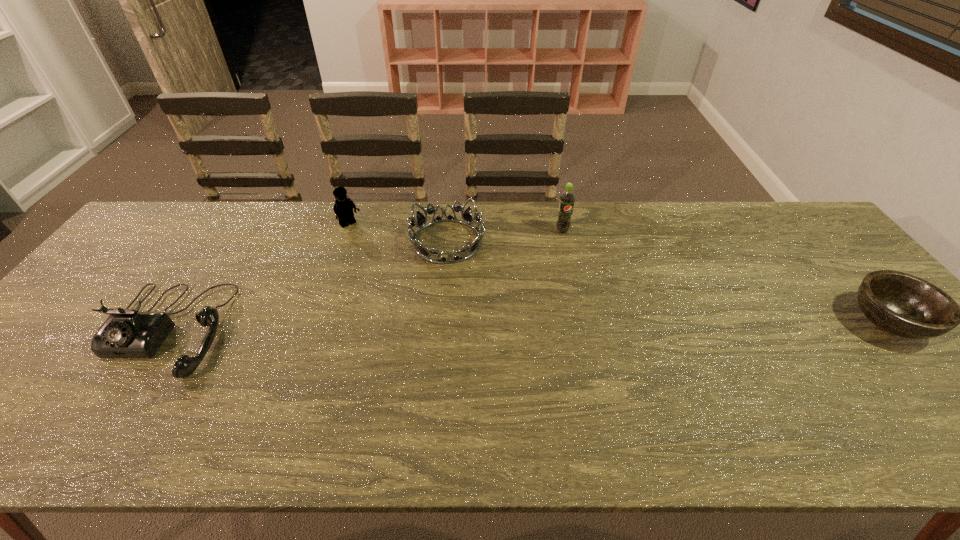
Where is `free spot located on the front label of the tallest object`? The image size is (960, 540). free spot located on the front label of the tallest object is located at coordinates (588, 292).

Where is `vacant space located 0.050m on the front label of the tallest object`? vacant space located 0.050m on the front label of the tallest object is located at coordinates (568, 245).

Locate an element on the screen. This screenshot has width=960, height=540. vacant space located on the front label of the tallest object is located at coordinates (604, 332).

Find the location of a particular element. blank area located on the front-facing side of the second object from left to right is located at coordinates (420, 299).

In order to click on free space located 0.070m on the front-facing side of the second object from left to right in this screenshot , I will do `click(366, 241)`.

This screenshot has height=540, width=960. Find the location of `vacant region located on the front-facing side of the second object from left to right`. vacant region located on the front-facing side of the second object from left to right is located at coordinates (407, 285).

This screenshot has width=960, height=540. I want to click on tiara located at the far edge, so click(424, 252).

You are a GUI agent. You are given a task and a screenshot of the screen. Output one action in this format:
    pyautogui.click(x=<x>, y=<y>)
    Task: Click on the soda situated at the far edge
    
    Given the screenshot: What is the action you would take?
    pyautogui.click(x=567, y=198)

Image resolution: width=960 pixels, height=540 pixels. Identify the location of Lego that is at the far edge. (343, 208).

Identify the location of object present at the near edge. This screenshot has width=960, height=540. (127, 333).